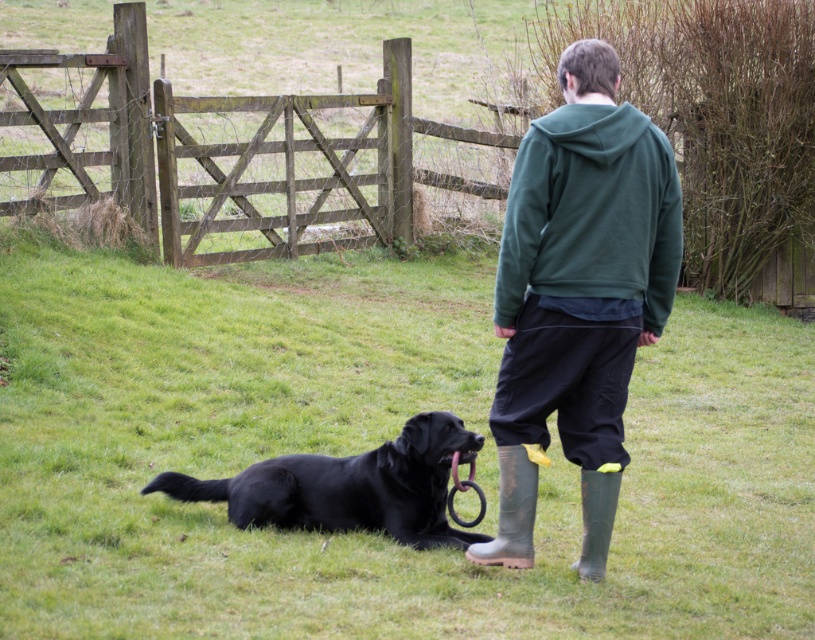
You are standing at the entrance of the wooden gate at center. You want to walk straight ahead. Will you immediately step onto grass?

Yes, because the wooden gate at center is positioned in a grassy field, so walking straight ahead from the entrance would lead onto the grass.

You are standing in the field and want to know how far the point at coordinates (139, 120) is from you. Can you determine the distance?

The distance of point (139, 120) from viewer is 12.93 meters.

You are a painter standing in the field and want to paint both the wooden gate at center and the green rubber boot at lower right. Which object should you focus on first if you want to paint the larger one first?

The wooden gate at center is bigger than the green rubber boot at lower right, so you should focus on painting the wooden gate at center first.